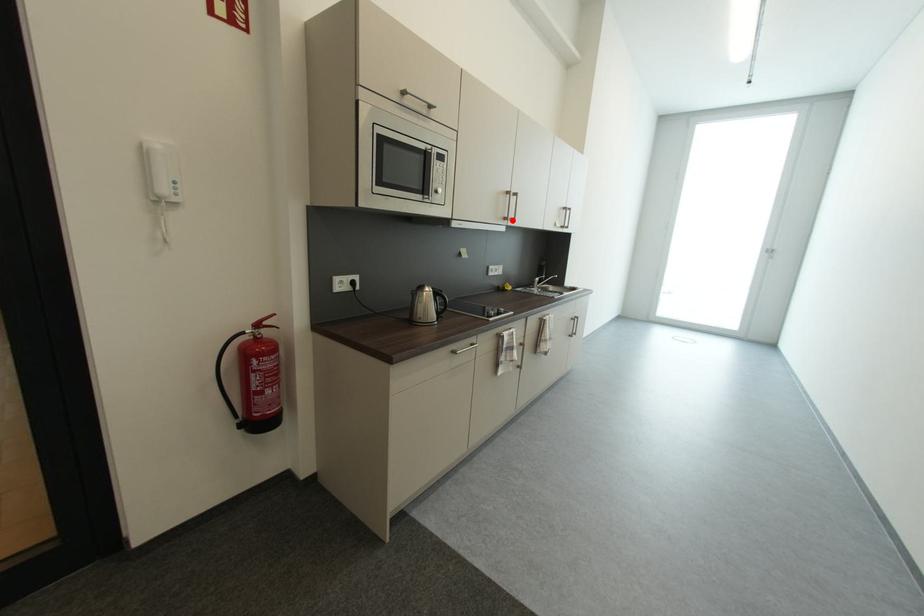
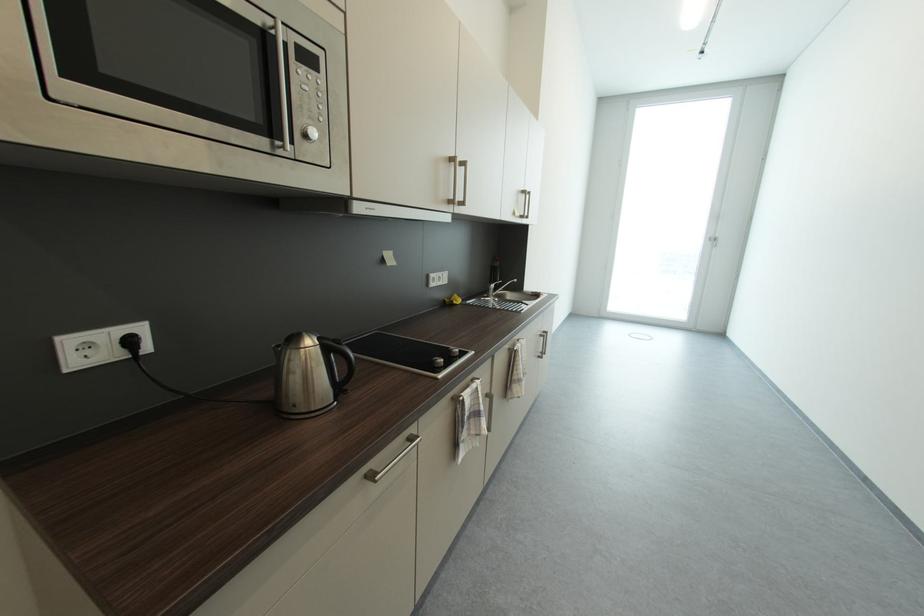
Question: I am providing you with two images of the same scene from different viewpoints. A red point is marked on the first image. Can you still see the location of the red point in image 2?

Choices:
 (A) Yes
 (B) No

Answer: (A)